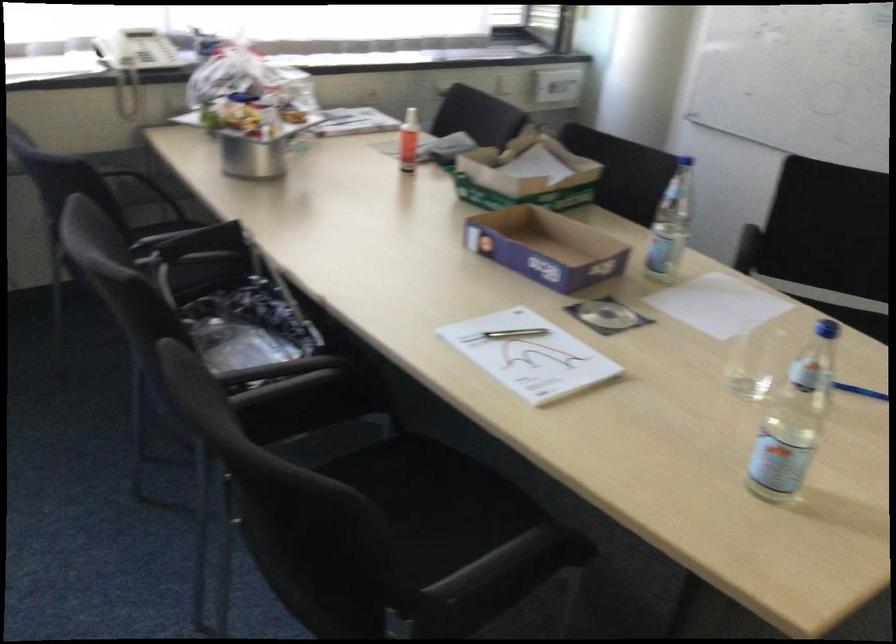
Identify the location of telephone handset. click(x=140, y=35).